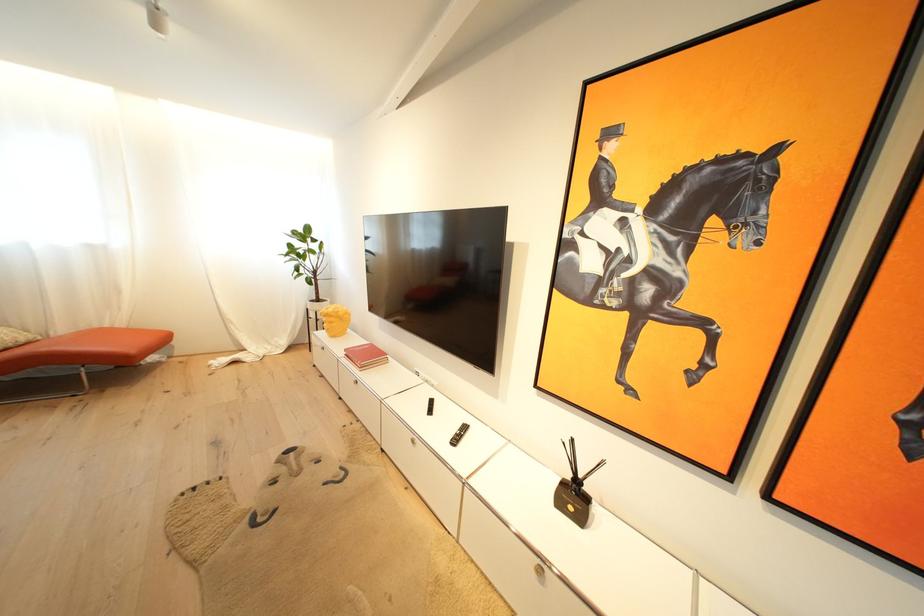
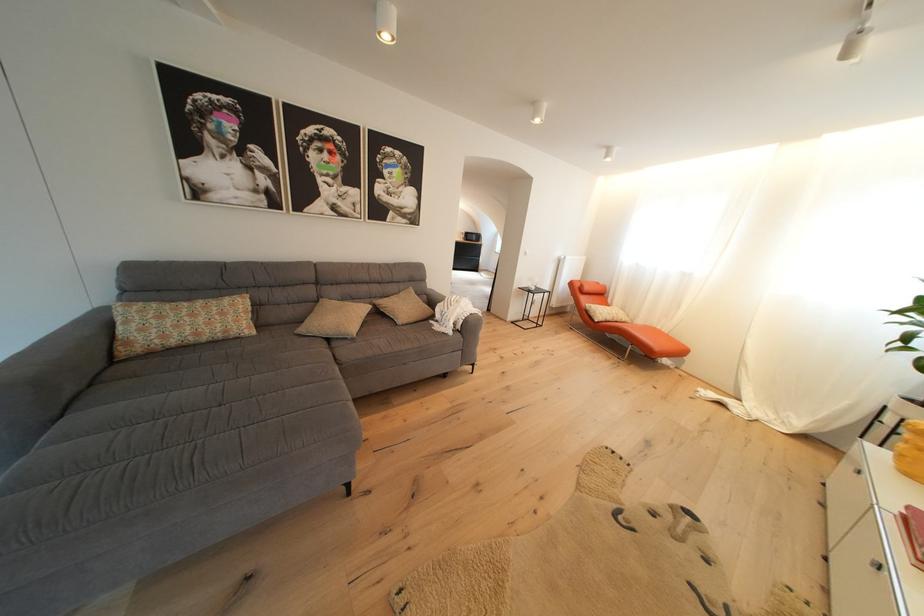
How did the camera likely rotate?

The camera rotated toward left-down.